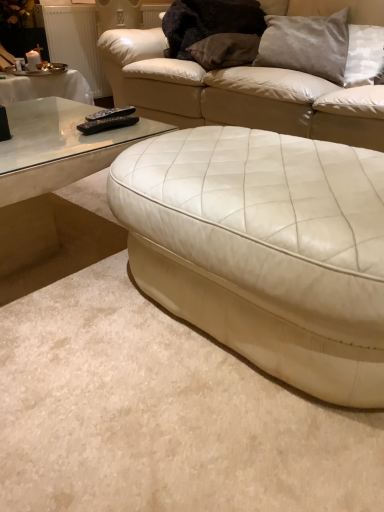
In order to click on empty space that is to the right of black plastic remote at left, which is the second remote in back-to-front order in this screenshot , I will do `click(143, 131)`.